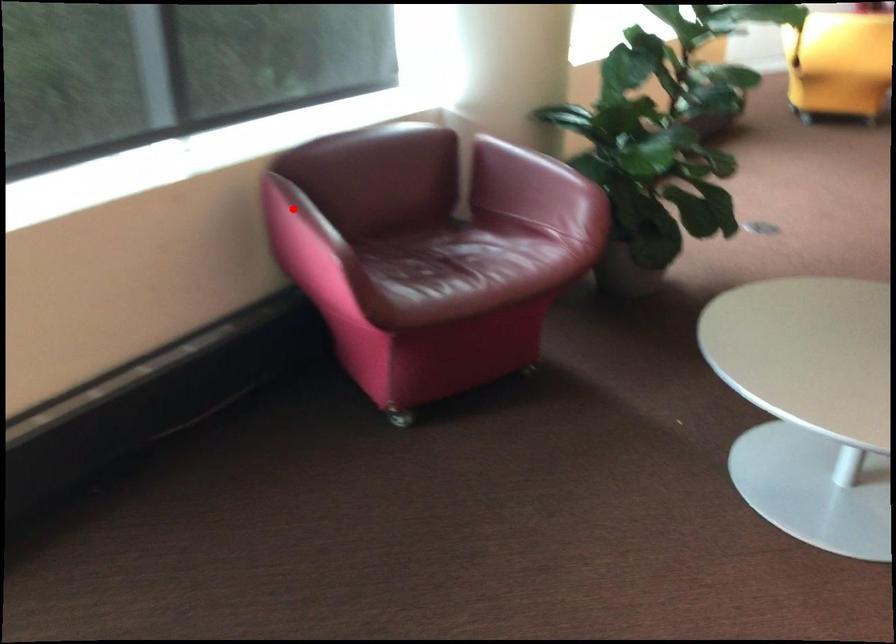
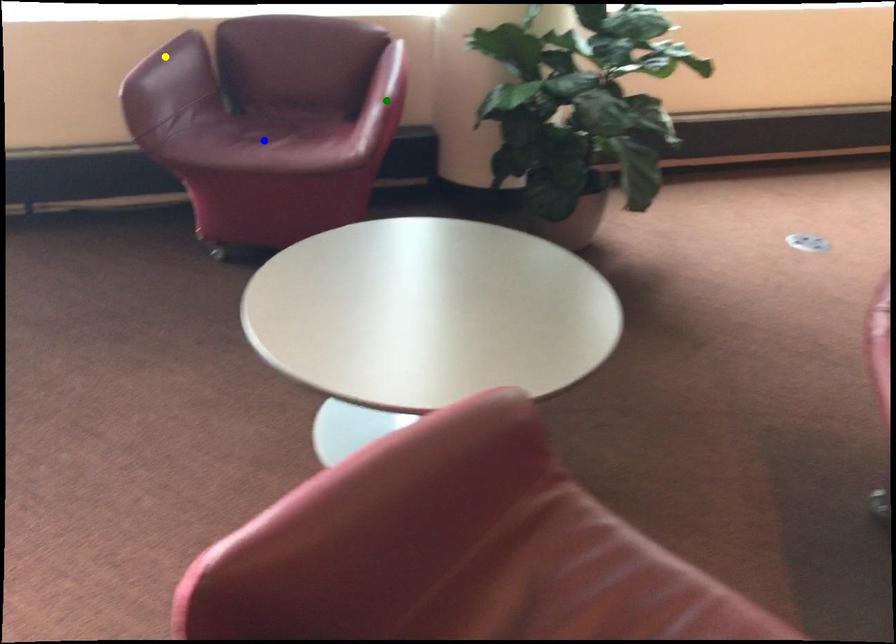
Question: I am providing you with two images of the same scene from different viewpoints. A red point is marked on the first image. You are given multiple points on the second image. In image 2, which mark is for the same physical point as the one in image 1?

Choices:
 (A) blue point
 (B) yellow point
 (C) green point

Answer: (B)